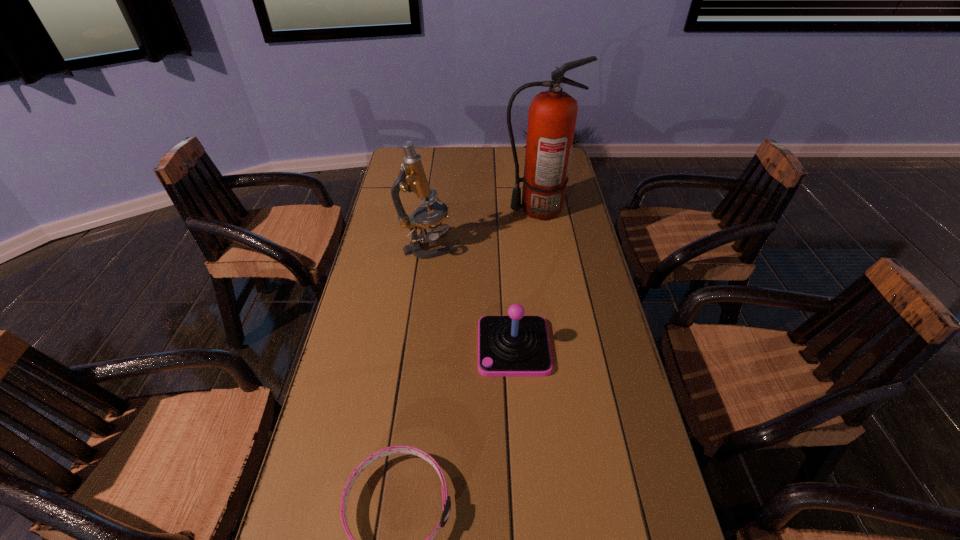
In order to click on fire extinguisher in this screenshot , I will do `click(552, 115)`.

In order to click on the farthest object in this screenshot , I will do `click(552, 115)`.

Identify the location of microscope. (412, 178).

The image size is (960, 540). In order to click on the third shortest object in this screenshot , I will do `click(412, 178)`.

You are a GUI agent. You are given a task and a screenshot of the screen. Output one action in this format:
    pyautogui.click(x=<x>, y=<y>)
    Task: Click on the third tallest object
    Image resolution: width=960 pixels, height=540 pixels.
    Given the screenshot: What is the action you would take?
    pyautogui.click(x=516, y=345)

Locate an element on the screen. This screenshot has height=540, width=960. the third farthest object is located at coordinates (516, 345).

The width and height of the screenshot is (960, 540). In order to click on free space located 0.390m on the nozzle of the tallest object in this screenshot , I will do `click(397, 209)`.

Find the location of `vacant area situated on the nozzle of the tallest object`. vacant area situated on the nozzle of the tallest object is located at coordinates (435, 209).

Find the location of `free space located on the nozzle of the tallest object`. free space located on the nozzle of the tallest object is located at coordinates (421, 209).

Where is `vacant point located on the right of the microscope`? vacant point located on the right of the microscope is located at coordinates (512, 247).